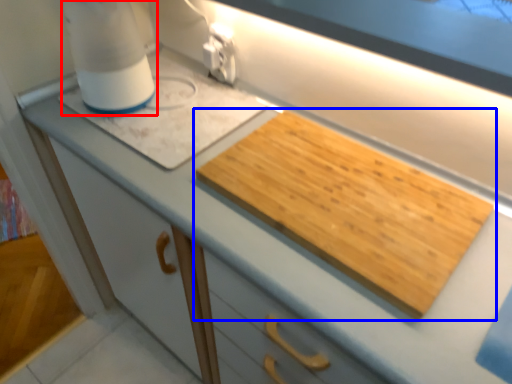
Question: Among these objects, which one is farthest to the camera, blender (highlighted by a red box) or cutting board (highlighted by a blue box)?

Choices:
 (A) blender
 (B) cutting board

Answer: (A)